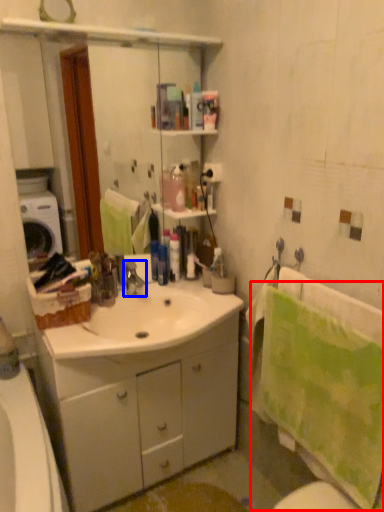
Question: Which of the following is the closest to the observer, bath towel (highlighted by a red box) or tap (highlighted by a blue box)?

Choices:
 (A) bath towel
 (B) tap

Answer: (A)